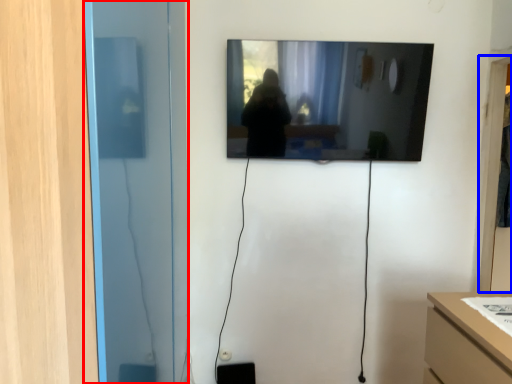
Question: Which object is further to the camera taking this photo, glass door (highlighted by a red box) or glass door (highlighted by a blue box)?

Choices:
 (A) glass door
 (B) glass door

Answer: (B)